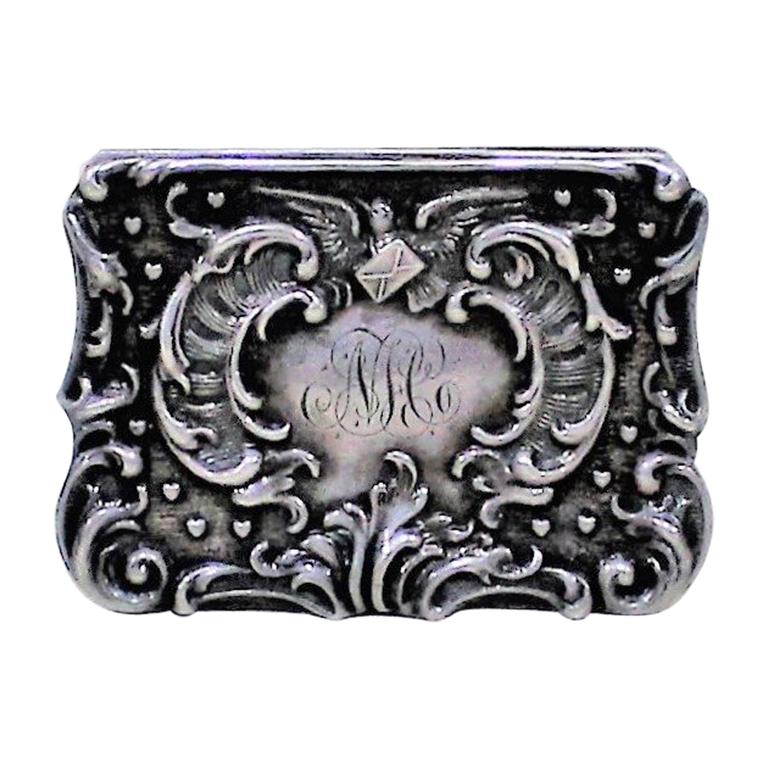
Locate an element on the screen. the bottom of pendant is located at coordinates (362, 614).